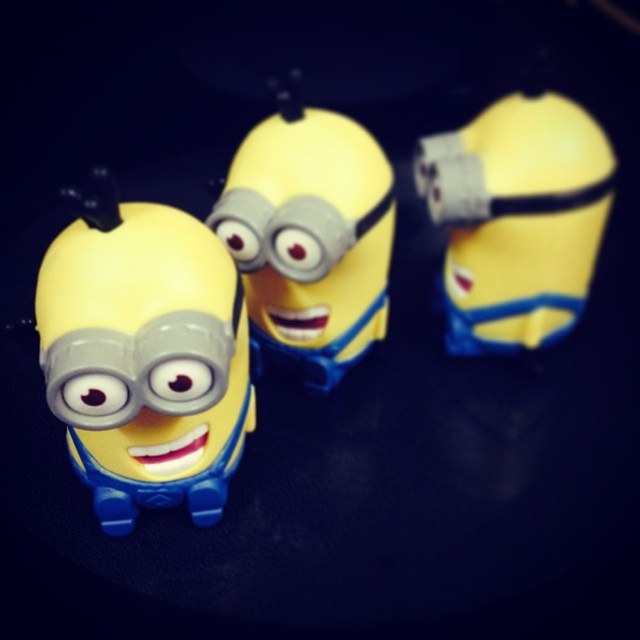
Is yellow matte toy at upper right above matte plastic minion at center?

Indeed, yellow matte toy at upper right is positioned over matte plastic minion at center.

Between point (452, 198) and point (310, 172), which one is positioned in front?

Point (310, 172) is in front.

Identify the location of yellow matte toy at upper right. The image size is (640, 640). (516, 218).

Between point (198, 340) and point (296, 216), which one is positioned in front?

Point (198, 340)

Is point (134, 358) positioned behind point (369, 280)?

That is False.

Locate an element on the screen. The height and width of the screenshot is (640, 640). matte plastic minion at left is located at coordinates (145, 355).

Looking at this image, is matte plastic minion at left bigger than yellow matte toy at upper right?

Correct, matte plastic minion at left is larger in size than yellow matte toy at upper right.

The width and height of the screenshot is (640, 640). Describe the element at coordinates (145, 355) in the screenshot. I see `matte plastic minion at left` at that location.

Find the location of a particular element. matte plastic minion at left is located at coordinates (145, 355).